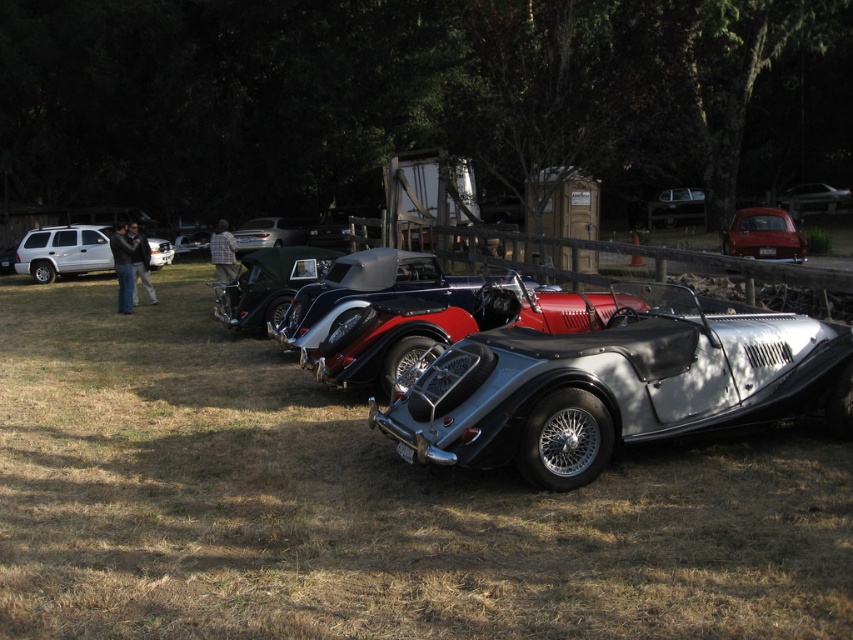
Question: Can you confirm if silver metallic convertible at center is bigger than shiny silver convertible at center?

Choices:
 (A) yes
 (B) no

Answer: (A)

Question: Considering the real-world distances, which object is closest to the metallic silver car at center?

Choices:
 (A) metallic red car at right
 (B) brown dry grass at center
 (C) shiny silver convertible at center

Answer: (A)

Question: Does brown dry grass at center have a larger size compared to metallic silver car at center?

Choices:
 (A) yes
 (B) no

Answer: (A)

Question: Estimate the real-world distances between objects in this image. Which object is closer to the silver metallic suv at left?

Choices:
 (A) metallic silver car at center
 (B) brown dry grass at center
 (C) shiny silver convertible at center

Answer: (C)

Question: Observing the image, what is the correct spatial positioning of metallic silver car at center in reference to shiny silver car at center?

Choices:
 (A) above
 (B) below

Answer: (A)

Question: Which point appears closest to the camera in this image?

Choices:
 (A) (161, 248)
 (B) (482, 436)
 (C) (671, 225)
 (D) (784, 257)

Answer: (B)